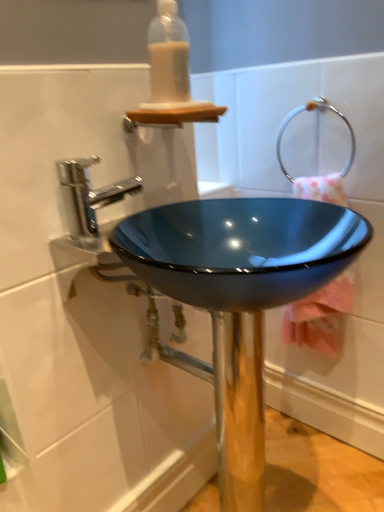
Question: From the image's perspective, would you say glossy blue bowl at center is shown under pink fabric towel at center right?

Choices:
 (A) no
 (B) yes

Answer: (B)

Question: Considering the relative sizes of glossy blue bowl at center and pink fabric towel at center right in the image provided, is glossy blue bowl at center taller than pink fabric towel at center right?

Choices:
 (A) no
 (B) yes

Answer: (B)

Question: Is glossy blue bowl at center shorter than pink fabric towel at center right?

Choices:
 (A) yes
 (B) no

Answer: (B)

Question: Does glossy blue bowl at center turn towards pink fabric towel at center right?

Choices:
 (A) yes
 (B) no

Answer: (B)

Question: Is glossy blue bowl at center bigger than pink fabric towel at center right?

Choices:
 (A) yes
 (B) no

Answer: (A)

Question: Is glossy blue bowl at center located outside pink fabric towel at center right?

Choices:
 (A) no
 (B) yes

Answer: (B)

Question: From a real-world perspective, is silver metallic towel ring at upper right located beneath polished chrome faucet at upper left?

Choices:
 (A) yes
 (B) no

Answer: (B)

Question: Can you confirm if silver metallic towel ring at upper right is wider than polished chrome faucet at upper left?

Choices:
 (A) yes
 (B) no

Answer: (B)

Question: Would you say silver metallic towel ring at upper right is outside polished chrome faucet at upper left?

Choices:
 (A) no
 (B) yes

Answer: (B)

Question: From a real-world perspective, is silver metallic towel ring at upper right physically above polished chrome faucet at upper left?

Choices:
 (A) yes
 (B) no

Answer: (A)

Question: Would you say silver metallic towel ring at upper right contains polished chrome faucet at upper left?

Choices:
 (A) no
 (B) yes

Answer: (A)

Question: Does silver metallic towel ring at upper right have a larger size compared to polished chrome faucet at upper left?

Choices:
 (A) yes
 (B) no

Answer: (A)

Question: Would you consider translucent plastic bottle at upper center to be distant from glossy blue bowl at center?

Choices:
 (A) yes
 (B) no

Answer: (B)